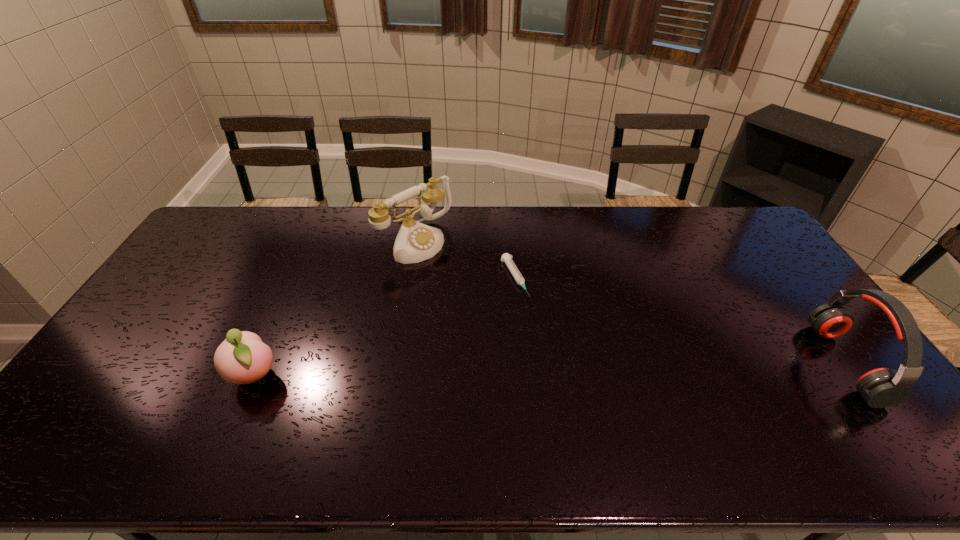
The image size is (960, 540). In order to click on vacant space situated on the dial of the telephone in this screenshot , I will do `click(464, 275)`.

Where is `free spot located on the dial of the telephone`? The width and height of the screenshot is (960, 540). free spot located on the dial of the telephone is located at coordinates (485, 291).

Where is `vacant space located 0.190m on the dial of the telephone`? vacant space located 0.190m on the dial of the telephone is located at coordinates (476, 285).

At what (x,y) coordinates should I click in order to perform the action: click on free region located 0.390m at the needle end of the syringe. Please return your answer as a coordinate pair (x, y). The width and height of the screenshot is (960, 540). Looking at the image, I should click on (582, 404).

Image resolution: width=960 pixels, height=540 pixels. I want to click on free space located 0.300m at the needle end of the syringe, so click(x=565, y=375).

Where is `vacant point located at the needle end of the syringe`? vacant point located at the needle end of the syringe is located at coordinates (545, 342).

Identify the location of object situated at the far edge. Image resolution: width=960 pixels, height=540 pixels. (415, 242).

Where is `peach that is at the near edge`? The height and width of the screenshot is (540, 960). peach that is at the near edge is located at coordinates (242, 358).

Locate an element on the screen. earphone located at the near edge is located at coordinates (883, 387).

Locate an element on the screen. The width and height of the screenshot is (960, 540). object present at the right edge is located at coordinates (883, 387).